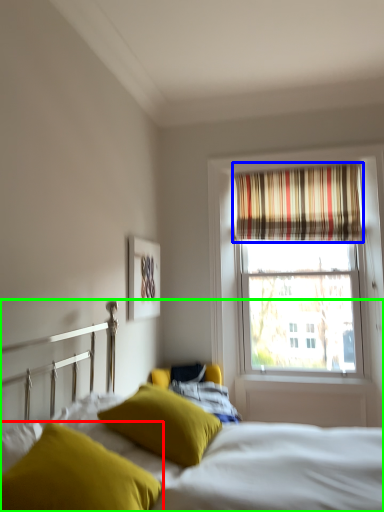
Question: Estimate the real-world distances between objects in this image. Which object is closer to pillow (highlighted by a red box), curtain (highlighted by a blue box) or bed (highlighted by a green box)?

Choices:
 (A) curtain
 (B) bed

Answer: (B)